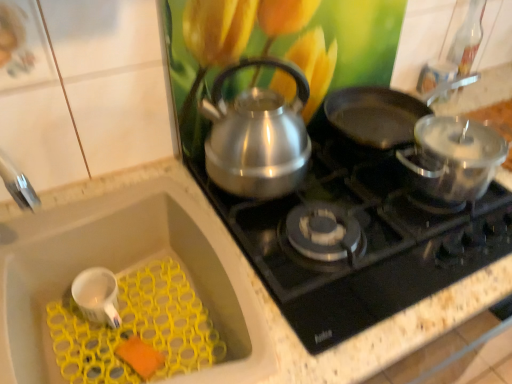
Question: Relative to white matte mug at lower left, is white matte sink at lower left in front or behind?

Choices:
 (A) behind
 (B) front

Answer: (B)

Question: Would you say white matte sink at lower left is inside or outside white matte mug at lower left?

Choices:
 (A) inside
 (B) outside

Answer: (B)

Question: Which of these objects is positioned farthest from the white matte sink at lower left?

Choices:
 (A) polished stainless steel kettle at upper center
 (B) satin silver kettle at center
 (C) shiny black frying pan at upper right
 (D) white matte mug at lower left

Answer: (C)

Question: Based on their relative distances, which object is farther from the white matte mug at lower left?

Choices:
 (A) white matte sink at lower left
 (B) polished stainless steel kettle at upper center
 (C) shiny black frying pan at upper right
 (D) satin silver kettle at center

Answer: (C)